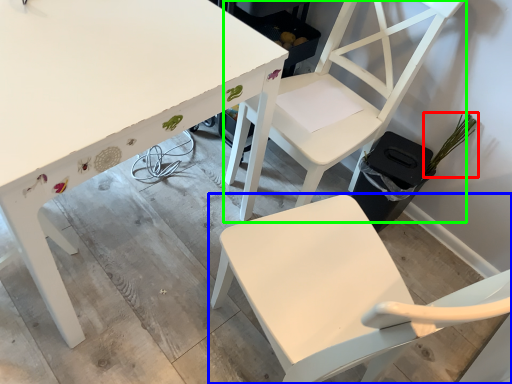
Question: Which is farther away from plant (highlighted by a red box)? chair (highlighted by a blue box) or chair (highlighted by a green box)?

Choices:
 (A) chair
 (B) chair

Answer: (A)